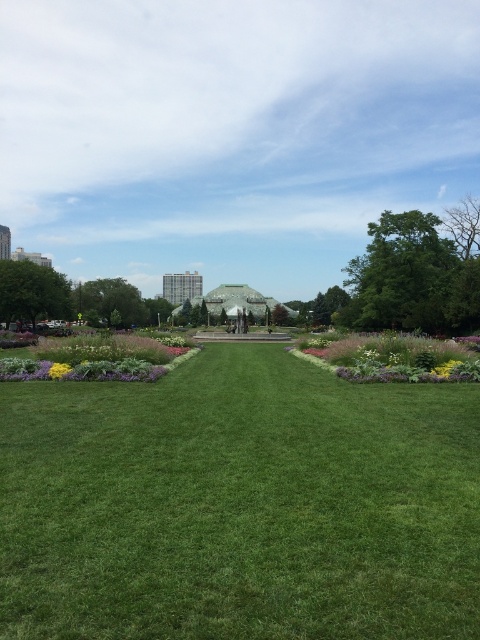
Is green grass lawn at center taller than yellow matte flower at center?

In fact, green grass lawn at center may be shorter than yellow matte flower at center.

Is green grass lawn at center to the right of yellow matte flower at center from the viewer's perspective?

No, green grass lawn at center is not to the right of yellow matte flower at center.

I want to click on green grass lawn at center, so pyautogui.click(x=240, y=506).

Is green grass at center bigger than yellow matte flower at lower left?

Yes, green grass at center is bigger than yellow matte flower at lower left.

Is point (219, 332) behind point (60, 364)?

Yes, point (219, 332) is behind point (60, 364).

Where is `green grass at center`? This screenshot has width=480, height=640. green grass at center is located at coordinates (240, 337).

Between yellow matte flower at lower left and yellow matte flower at center, which one has more height?

yellow matte flower at lower left is taller.

Where is `yellow matte flower at lower left`? The height and width of the screenshot is (640, 480). yellow matte flower at lower left is located at coordinates (59, 371).

This screenshot has height=640, width=480. Find the location of `yellow matte flower at lower left`. yellow matte flower at lower left is located at coordinates (59, 371).